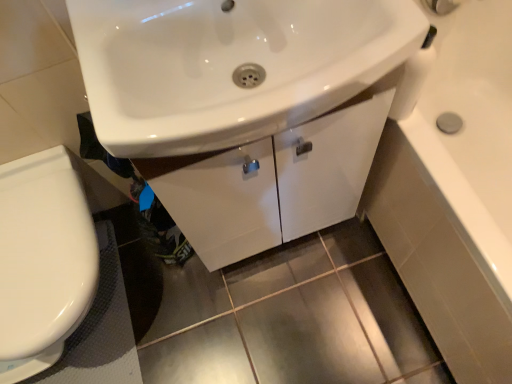
This screenshot has height=384, width=512. Identify the location of vacant area on top of white glossy cabinet at center (from a real-world perspective). (238, 27).